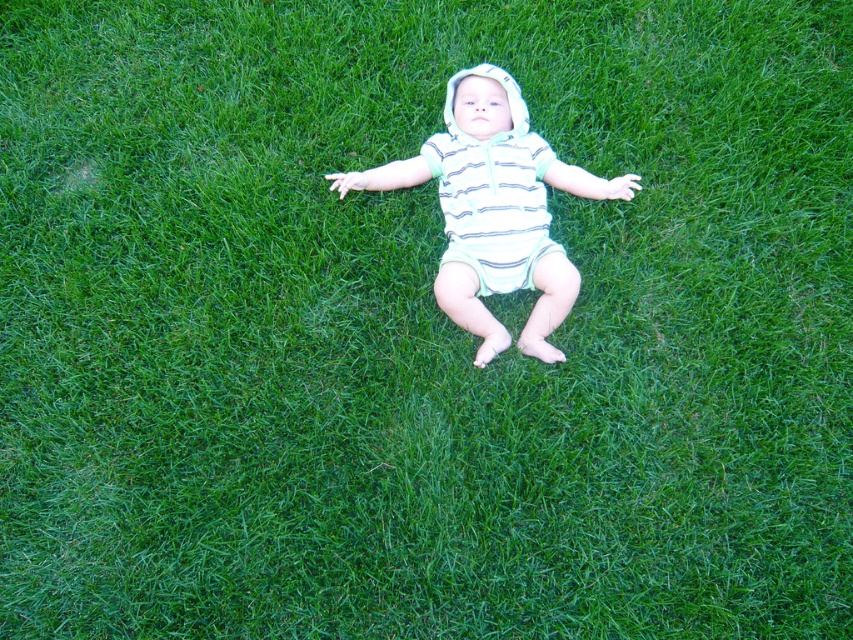
Question: Does striped cotton onesie at center appear on the right side of striped cotton diaper at center?

Choices:
 (A) yes
 (B) no

Answer: (A)

Question: Does striped cotton onesie at center have a lesser width compared to striped cotton diaper at center?

Choices:
 (A) no
 (B) yes

Answer: (A)

Question: Is striped cotton onesie at center below striped cotton diaper at center?

Choices:
 (A) no
 (B) yes

Answer: (A)

Question: Which of the following is the closest to the observer?

Choices:
 (A) (544, 152)
 (B) (473, 243)

Answer: (B)

Question: Which of the following is the closest to the observer?

Choices:
 (A) striped cotton diaper at center
 (B) striped cotton onesie at center

Answer: (B)

Question: Which point is farther to the camera?

Choices:
 (A) striped cotton onesie at center
 (B) striped cotton diaper at center

Answer: (B)